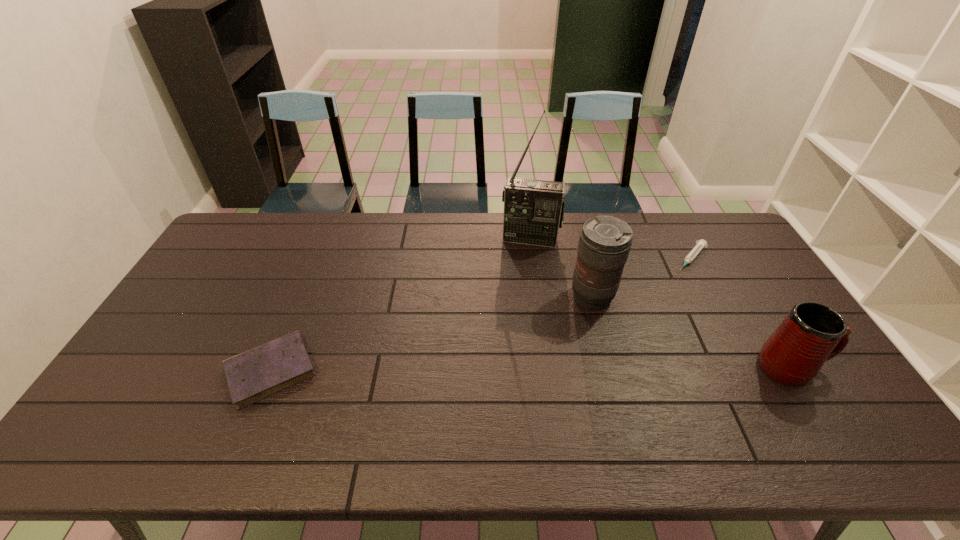
Locate an element on the screen. The image size is (960, 540). mug at the right edge is located at coordinates (812, 333).

You are a GUI agent. You are given a task and a screenshot of the screen. Output one action in this format:
    pyautogui.click(x=<x>, y=<y>)
    Task: Click on the syringe situated at the right edge
    This screenshot has width=960, height=540.
    Given the screenshot: What is the action you would take?
    pyautogui.click(x=700, y=244)

Find the location of a particular element. object that is at the far right corner is located at coordinates (700, 244).

Where is `object located in the near right corner section of the desktop`? Image resolution: width=960 pixels, height=540 pixels. object located in the near right corner section of the desktop is located at coordinates [812, 333].

The width and height of the screenshot is (960, 540). What are the coordinates of `free location at the far edge of the desktop` in the screenshot? It's located at coord(398,234).

Image resolution: width=960 pixels, height=540 pixels. In the image, there is a desktop. Find the location of `vacant space at the near edge`. vacant space at the near edge is located at coordinates pyautogui.click(x=556, y=393).

At what (x,y) coordinates should I click in order to perform the action: click on free space at the left edge of the desktop. Please return your answer as a coordinate pair (x, y). Looking at the image, I should click on (180, 362).

Where is `vacant space at the right edge of the desktop`? vacant space at the right edge of the desktop is located at coordinates (748, 334).

The height and width of the screenshot is (540, 960). In the image, there is a desktop. In order to click on free space at the far left corner in this screenshot , I will do `click(276, 218)`.

The image size is (960, 540). I want to click on free point at the near left corner, so click(159, 407).